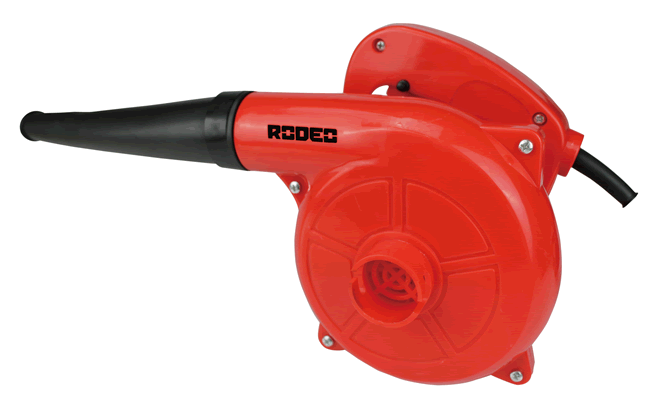
I want to click on cord, so click(599, 174).